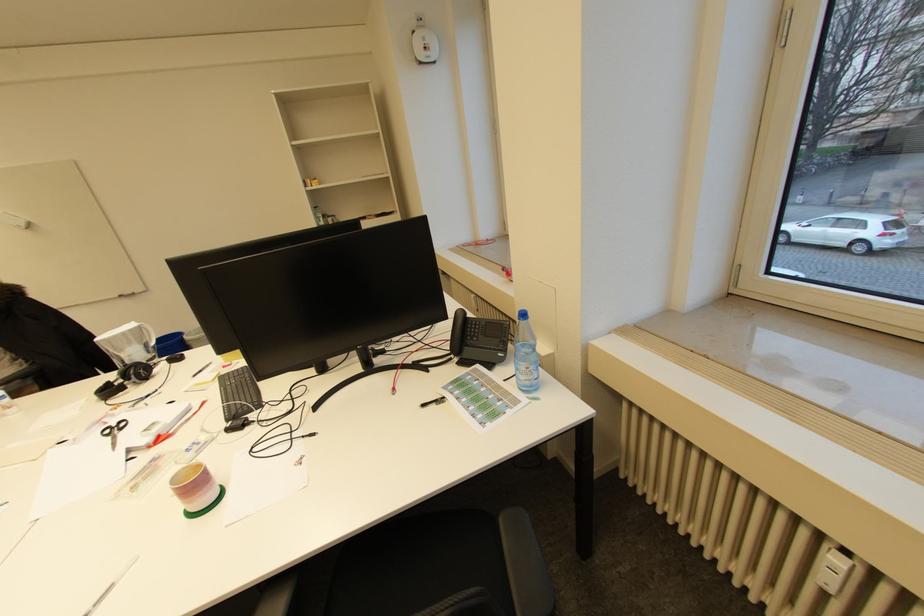
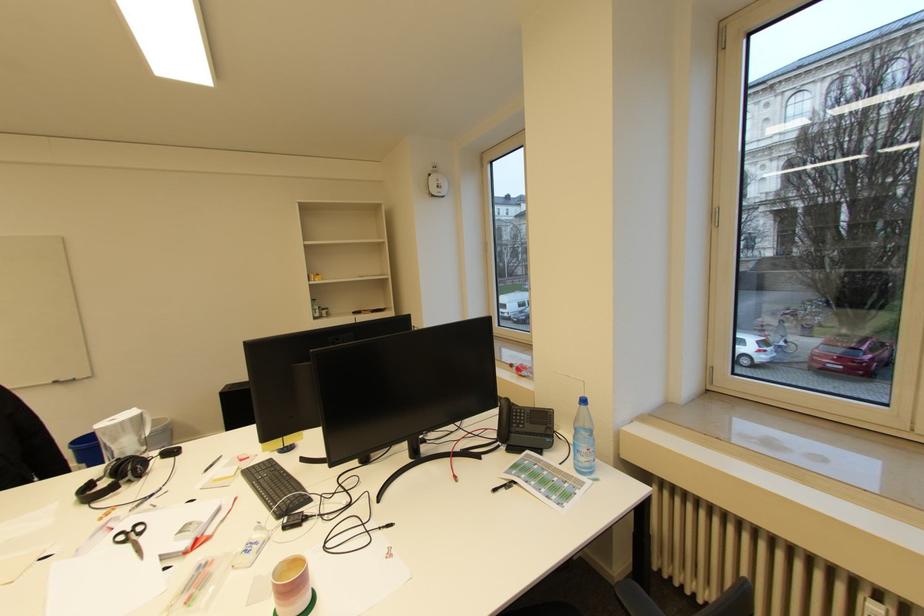
Locate, in the second image, the point that corresponds to the point at 220,381 in the first image.

(241, 475)